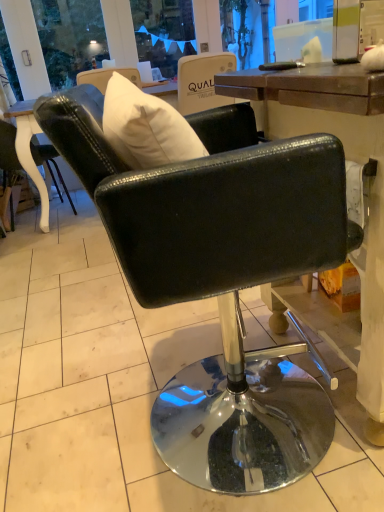
Question: Which direction should I rotate to face glossy black chair at center, the first chair positioned from the front, — up or down?

Choices:
 (A) up
 (B) down

Answer: (B)

Question: Are black leather chair at left, placed as the 1th chair when sorted from left to right, and glossy black chair at center, which is counted as the 2th chair, starting from the left, making contact?

Choices:
 (A) no
 (B) yes

Answer: (A)

Question: Is black leather chair at left, acting as the second chair starting from the front, taller than glossy black chair at center, the first chair from the right?

Choices:
 (A) yes
 (B) no

Answer: (B)

Question: Would you consider black leather chair at left, placed as the 1th chair when sorted from left to right, to be distant from glossy black chair at center, the first chair positioned from the front?

Choices:
 (A) no
 (B) yes

Answer: (B)

Question: From the image's perspective, is black leather chair at left, placed as the 1th chair when sorted from left to right, on glossy black chair at center, which ranks as the second chair in back-to-front order?

Choices:
 (A) no
 (B) yes

Answer: (B)

Question: Is glossy black chair at center, which is counted as the 2th chair, starting from the left, inside black leather chair at left, placed as the 2th chair when sorted from right to left?

Choices:
 (A) yes
 (B) no

Answer: (B)

Question: From a real-world perspective, is black leather chair at left, which ranks as the 1th chair in back-to-front order, positioned over glossy black chair at center, the first chair positioned from the front, based on gravity?

Choices:
 (A) yes
 (B) no

Answer: (B)

Question: Is glossy black chair at center, which is counted as the 2th chair, starting from the left, facing away from black leather chair at left, placed as the 2th chair when sorted from right to left?

Choices:
 (A) yes
 (B) no

Answer: (B)

Question: Is glossy black chair at center, which is counted as the 2th chair, starting from the left, outside black leather chair at left, acting as the second chair starting from the front?

Choices:
 (A) no
 (B) yes

Answer: (B)

Question: Does glossy black chair at center, which is counted as the 2th chair, starting from the left, have a smaller size compared to black leather chair at left, which ranks as the 1th chair in back-to-front order?

Choices:
 (A) no
 (B) yes

Answer: (A)

Question: Considering the relative sizes of glossy black chair at center, the first chair positioned from the front, and black leather chair at left, which ranks as the 1th chair in back-to-front order, in the image provided, is glossy black chair at center, the first chair positioned from the front, wider than black leather chair at left, which ranks as the 1th chair in back-to-front order,?

Choices:
 (A) yes
 (B) no

Answer: (A)

Question: Is glossy black chair at center, the first chair from the right, to the right of black leather chair at left, acting as the second chair starting from the front, from the viewer's perspective?

Choices:
 (A) no
 (B) yes

Answer: (B)

Question: From the image's perspective, would you say glossy black chair at center, the first chair positioned from the front, is shown under black leather chair at left, acting as the second chair starting from the front?

Choices:
 (A) no
 (B) yes

Answer: (B)

Question: From the image's perspective, is glossy black chair at center, which is counted as the 2th chair, starting from the left, positioned above or below black leather chair at left, acting as the second chair starting from the front?

Choices:
 (A) above
 (B) below

Answer: (B)